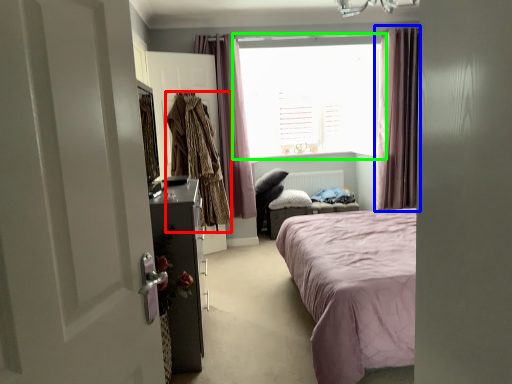
Question: Which is farther away from clothing (highlighted by a red box)? curtain (highlighted by a blue box) or window (highlighted by a green box)?

Choices:
 (A) curtain
 (B) window

Answer: (A)